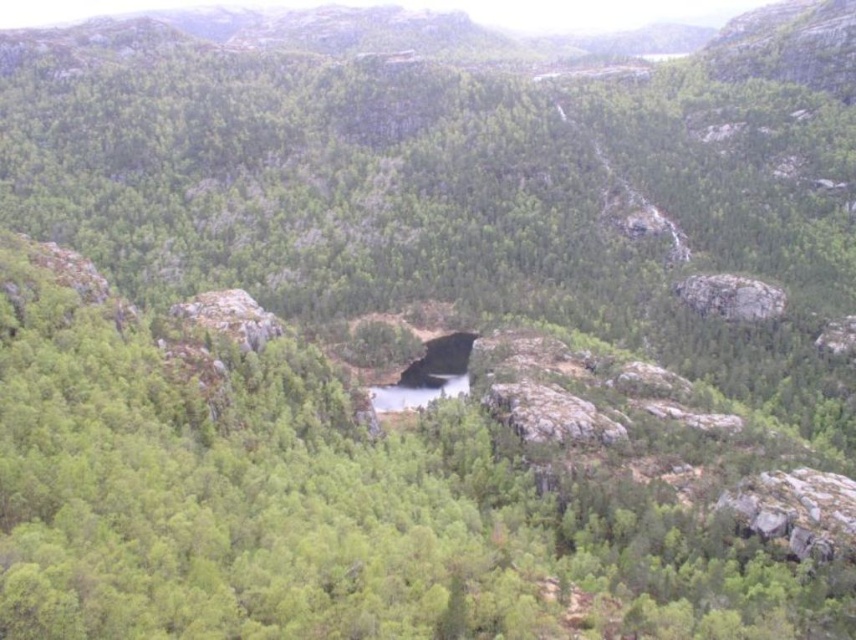
You are a hiker navigating through the forest and see the green matte tree at center and the rough gray rock at upper right. Which object is closer to you?

The green matte tree at center is closer to you as it is positioned in front of the rough gray rock at upper right.

You are a hiker who wants to take a photo of the green matte tree at center and the rough gray rock at upper right. Which object should you focus on first if you want both to be in sharp focus?

The green matte tree at center is taller than the rough gray rock at upper right, so you should focus on the green matte tree at center first to ensure both are in sharp focus.

You are a hiker who has just reached the summit and wants to take a photo of the green matte tree at center and the rough gray rock at upper right. Which object will appear higher in your camera viewfinder?

The rough gray rock at upper right will appear higher in your camera viewfinder because it is located above the green matte tree at center.